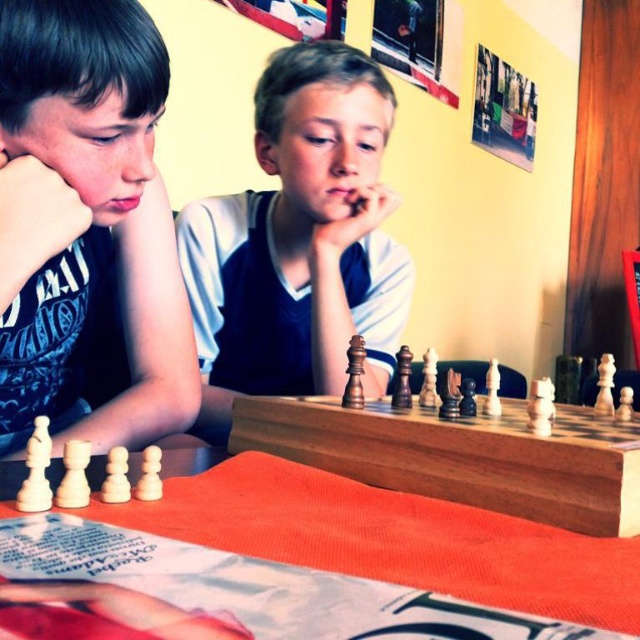
Between point (36, 387) and point (292, 120), which one is positioned behind?

Point (292, 120)

Can you confirm if matte black shirt at left is shorter than matte wooden chess piece at center?

Yes.

Where is `matte black shirt at left`? This screenshot has height=640, width=640. matte black shirt at left is located at coordinates (88, 232).

Identify the location of matte black shirt at left. (88, 232).

Who is more distant from viewer, (x=193, y=416) or (x=403, y=573)?

The point (x=193, y=416) is behind.

Who is taller, matte black shirt at left or wooden chessboard at center?

matte black shirt at left

Who is more distant from viewer, [188,356] or [406,506]?

Positioned behind is point [188,356].

Where is `matte black shirt at left`? The width and height of the screenshot is (640, 640). matte black shirt at left is located at coordinates (88, 232).

Can you confirm if matte wooden chess piece at center is taller than wooden chessboard at center?

Indeed, matte wooden chess piece at center has a greater height compared to wooden chessboard at center.

Is matte wooden chess piece at center smaller than wooden chessboard at center?

Incorrect, matte wooden chess piece at center is not smaller in size than wooden chessboard at center.

Describe the element at coordinates (300, 241) in the screenshot. I see `matte wooden chess piece at center` at that location.

Find the location of `matte wooden chess piece at center`. matte wooden chess piece at center is located at coordinates (300, 241).